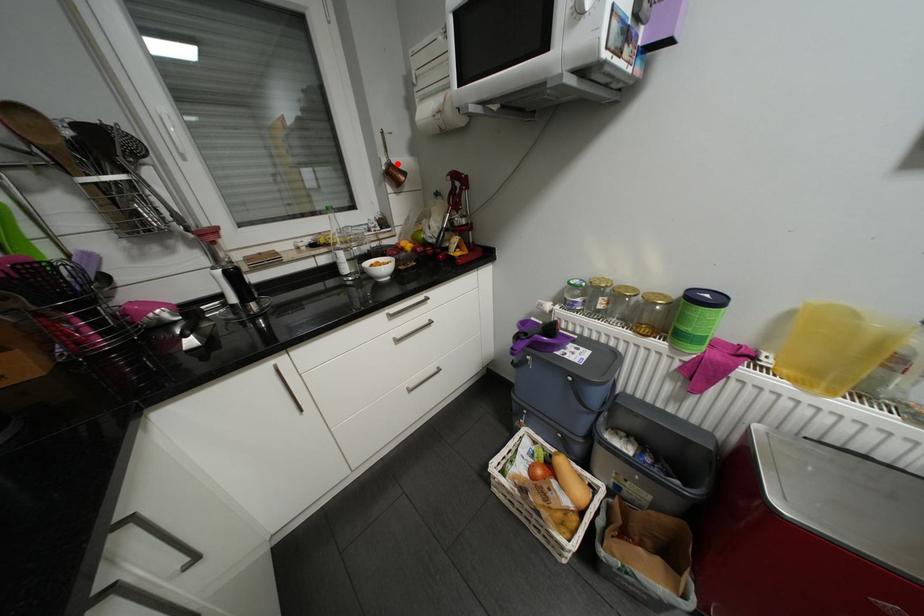
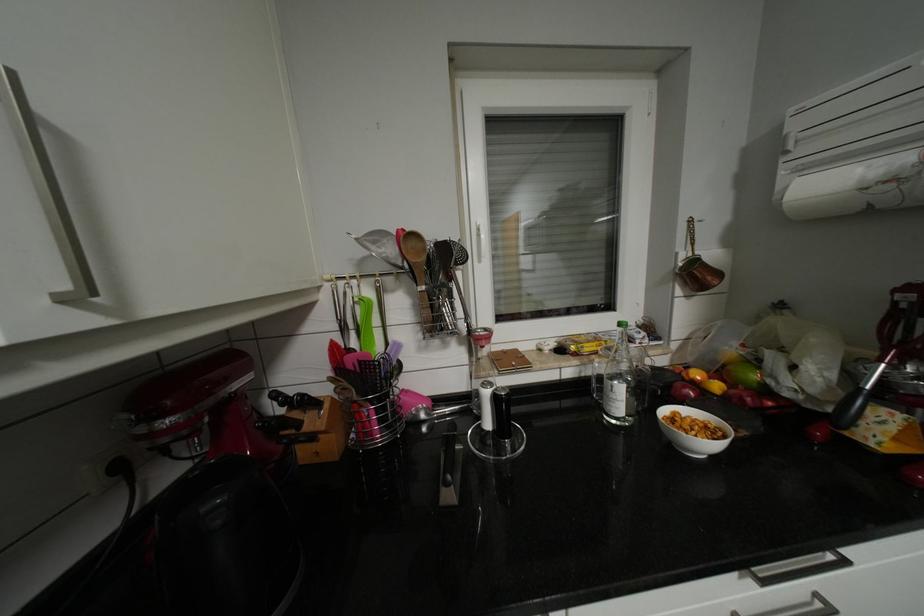
The point at the highlighted location is marked in the first image. Where is the corresponding point in the second image?

(702, 261)